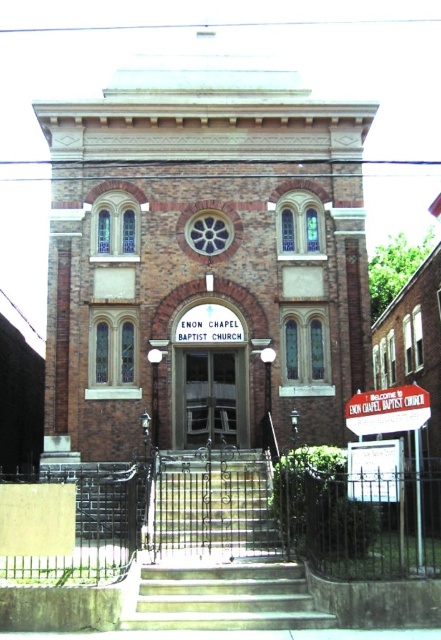
Question: Does concrete stairs at center have a lesser width compared to metallic stair at center?

Choices:
 (A) yes
 (B) no

Answer: (B)

Question: Considering the real-world distances, which object is farthest from the metallic stair at center?

Choices:
 (A) wooden door at center
 (B) white plastic sign at center
 (C) brown brick chapel at center

Answer: (C)

Question: Which object is farther from the camera taking this photo?

Choices:
 (A) metallic stair at center
 (B) wooden door at center
 (C) brown brick chapel at center
 (D) concrete stairs at center

Answer: (B)

Question: In this image, where is metallic stair at center located relative to wooden door at center?

Choices:
 (A) right
 (B) left

Answer: (B)

Question: Among these objects, which one is farthest from the camera?

Choices:
 (A) brown brick chapel at center
 (B) metallic stair at center
 (C) wooden door at center

Answer: (C)

Question: Does brown brick chapel at center appear on the right side of wooden door at center?

Choices:
 (A) yes
 (B) no

Answer: (B)